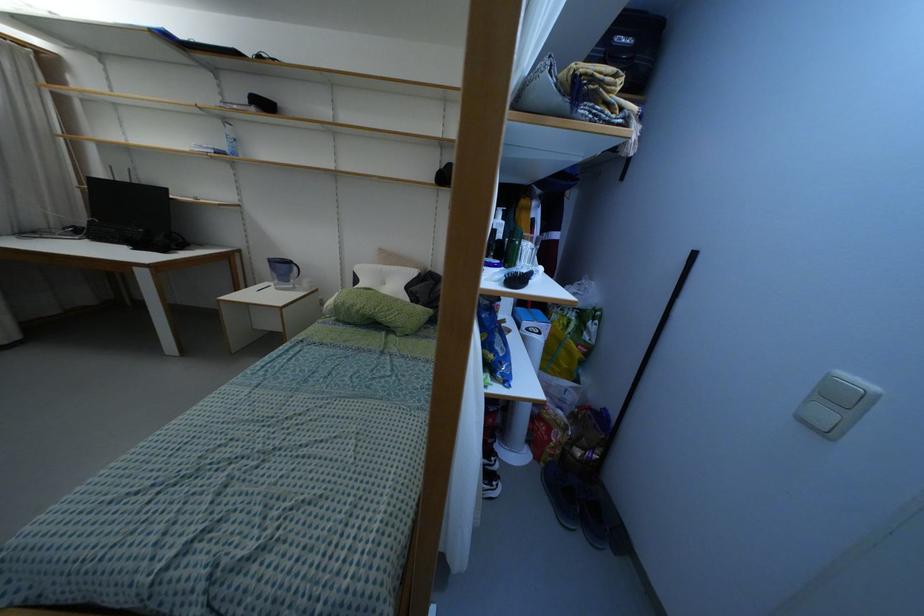
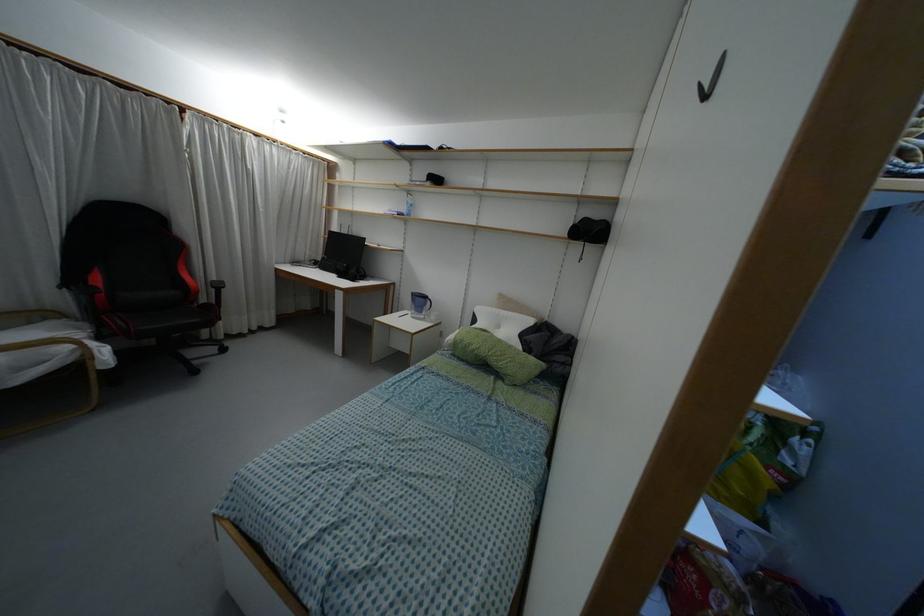
The point at (139,246) is marked in the first image. Where is the corresponding point in the second image?

(341, 275)